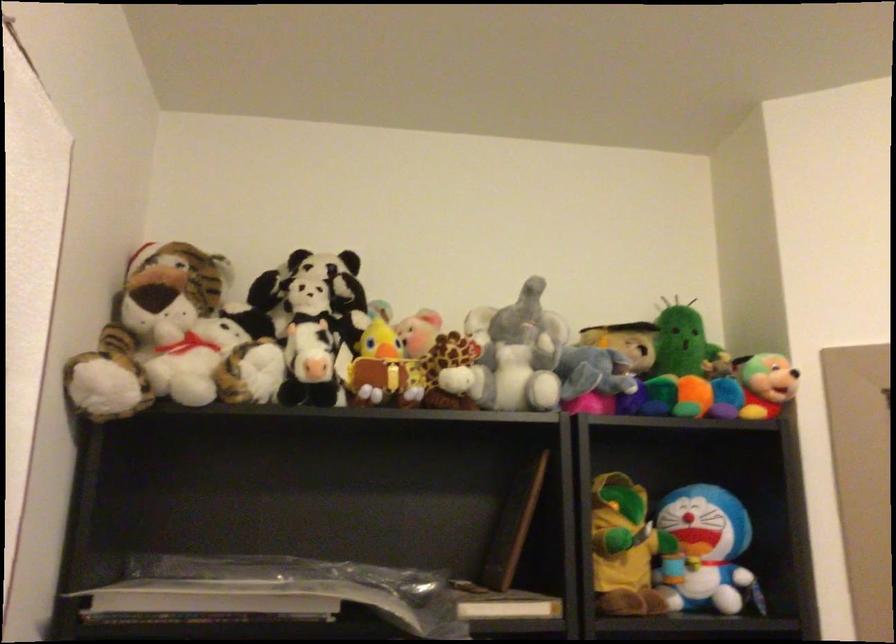
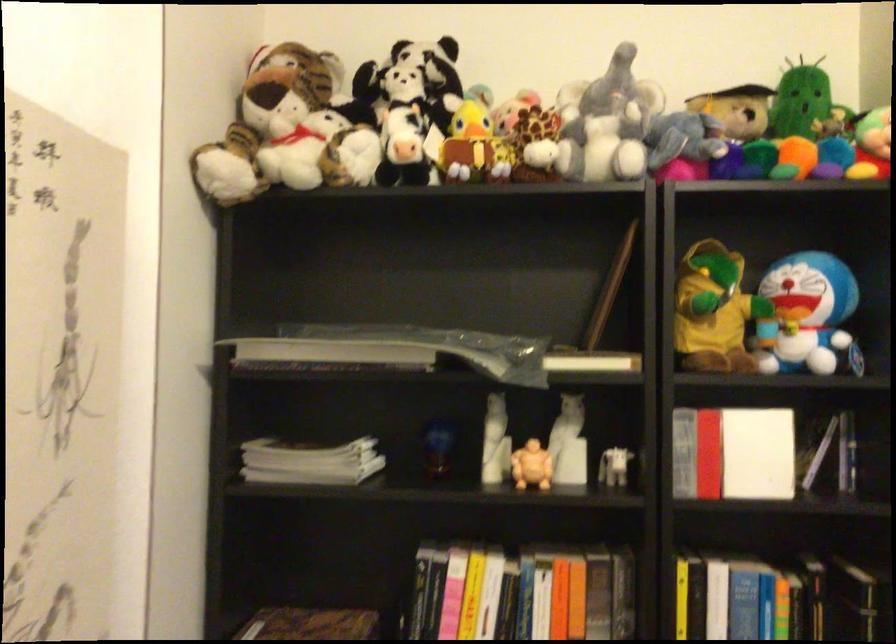
Locate, in the second image, the point that corresponds to the point at 683,335 in the first image.

(799, 100)